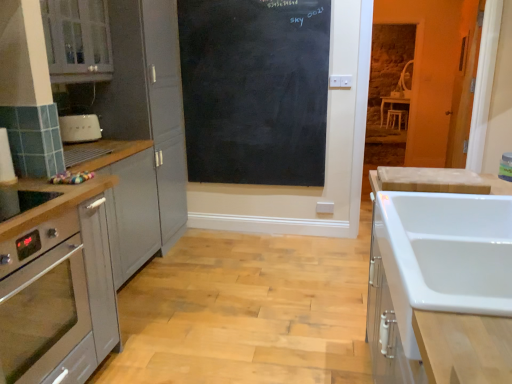
Identify the location of vacant area that is situated to the right of white matte toaster at left, placed as the 1th appliance when sorted from top to bottom. This screenshot has width=512, height=384. (111, 142).